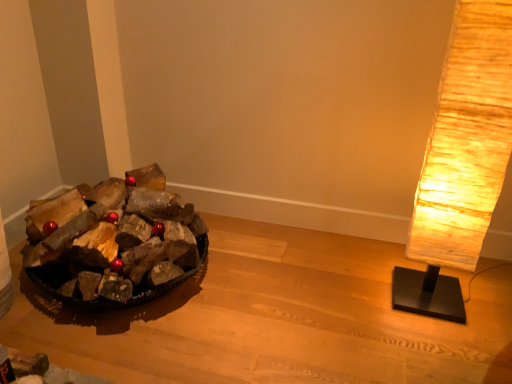
Find the location of `rustic paper lamp at right`. rustic paper lamp at right is located at coordinates (461, 160).

You are a GUI agent. You are given a task and a screenshot of the screen. Output one action in this format:
    pyautogui.click(x=<x>, y=<y>)
    Task: Click on the rustic paper lamp at right
    Image resolution: width=512 pixels, height=384 pixels.
    Given the screenshot: What is the action you would take?
    pyautogui.click(x=461, y=160)

From the image's perspective, would you say rustic paper lamp at right is positioned over dark brown wood at left?

Yes, from the image's perspective, rustic paper lamp at right is on top of dark brown wood at left.

Is rustic paper lamp at right taller than dark brown wood at left?

Correct, rustic paper lamp at right is much taller as dark brown wood at left.

Is point (493, 39) closer or farther from the camera than point (102, 185)?

Point (493, 39) is positioned closer to the camera compared to point (102, 185).

In the image, there is a dark brown wood at left. Where is `lamp above it (from the image's perspective)`? This screenshot has width=512, height=384. lamp above it (from the image's perspective) is located at coordinates (461, 160).

Which is more to the right, wooden logs at left or rustic paper lamp at right?

Positioned to the right is rustic paper lamp at right.

Which of these two, wooden logs at left or rustic paper lamp at right, stands taller?

rustic paper lamp at right is taller.

Is wooden logs at left outside of rustic paper lamp at right?

Yes, wooden logs at left is not within rustic paper lamp at right.

From the image's perspective, would you say wooden logs at left is shown under rustic paper lamp at right?

Indeed, from the image's perspective, wooden logs at left is shown beneath rustic paper lamp at right.

Based on their sizes in the image, would you say dark brown wood at left is bigger or smaller than wooden logs at left?

Considering their sizes, dark brown wood at left takes up more space than wooden logs at left.

Locate an element on the screen. The image size is (512, 384). furniture below the dark brown wood at left (from a real-world perspective) is located at coordinates (275, 319).

How distant is dark brown wood at left from wooden logs at left?

dark brown wood at left and wooden logs at left are 14.67 inches apart.

Considering the positions of objects dark brown wood at left and wooden logs at left in the image provided, who is more to the left, dark brown wood at left or wooden logs at left?

dark brown wood at left.

Do you think dark brown wood at left is within rustic paper lamp at right, or outside of it?

dark brown wood at left lies outside rustic paper lamp at right.

Is dark brown wood at left not close to rustic paper lamp at right?

dark brown wood at left is positioned a significant distance from rustic paper lamp at right.

From the image's perspective, would you say dark brown wood at left is positioned over rustic paper lamp at right?

No, from the image's perspective, dark brown wood at left is not on top of rustic paper lamp at right.

Considering the sizes of objects dark brown wood at left and rustic paper lamp at right in the image provided, who is bigger, dark brown wood at left or rustic paper lamp at right?

dark brown wood at left.

Based on the photo, is rustic paper lamp at right oriented away from wooden logs at left?

That's not correct — rustic paper lamp at right is not looking away from wooden logs at left.

Considering the sizes of objects rustic paper lamp at right and wooden logs at left in the image provided, who is taller, rustic paper lamp at right or wooden logs at left?

Standing taller between the two is rustic paper lamp at right.

From a real-world perspective, is rustic paper lamp at right on top of wooden logs at left?

Yes, from a real-world perspective, rustic paper lamp at right is above wooden logs at left.

In the scene shown: Considering the positions of objects rustic paper lamp at right and wooden logs at left in the image provided, who is more to the left, rustic paper lamp at right or wooden logs at left?

wooden logs at left.

Is wooden logs at left oriented towards dark brown wood at left?

No.

Which object is positioned more to the left, wooden logs at left or dark brown wood at left?

Positioned to the left is dark brown wood at left.

Looking at this image, from the image's perspective, which is above, wooden logs at left or dark brown wood at left?

From the image's view, dark brown wood at left is above.

Is wooden logs at left completely or partially outside of dark brown wood at left?

wooden logs at left is positioned outside dark brown wood at left.

Find the location of a particular element. debris below the rustic paper lamp at right (from the image's perspective) is located at coordinates (131, 244).

Identify the location of furniture on the left of rustic paper lamp at right. (275, 319).

Based on their spatial positions, is wooden logs at left or rustic paper lamp at right closer to dark brown wood at left?

wooden logs at left is closer to dark brown wood at left.

From the image, which object appears to be nearer to dark brown wood at left, rustic paper lamp at right or wooden logs at left?

Based on the image, wooden logs at left appears to be nearer to dark brown wood at left.

When comparing their distances from rustic paper lamp at right, does wooden logs at left or dark brown wood at left seem further?

dark brown wood at left is further to rustic paper lamp at right.

From the image, which object appears to be nearer to wooden logs at left, rustic paper lamp at right or dark brown wood at left?

dark brown wood at left is closer to wooden logs at left.

Which object lies nearer to the anchor point wooden logs at left, dark brown wood at left or rustic paper lamp at right?

dark brown wood at left is positioned closer to the anchor wooden logs at left.

Which object lies further to the anchor point rustic paper lamp at right, dark brown wood at left or wooden logs at left?

The object further to rustic paper lamp at right is dark brown wood at left.

This screenshot has height=384, width=512. I want to click on furniture situated between dark brown wood at left and rustic paper lamp at right from left to right, so click(x=275, y=319).